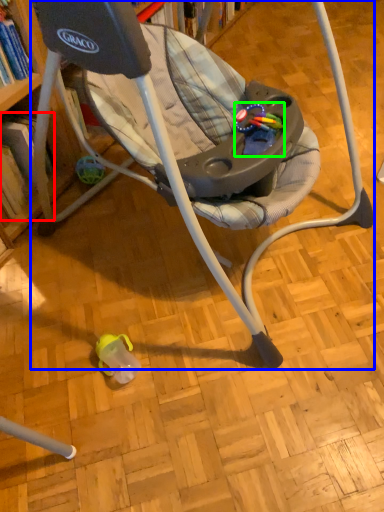
Question: Which object is positioned farthest from book (highlighted by a red box)? Select from chair (highlighted by a blue box) and toy (highlighted by a green box).

Choices:
 (A) chair
 (B) toy

Answer: (B)